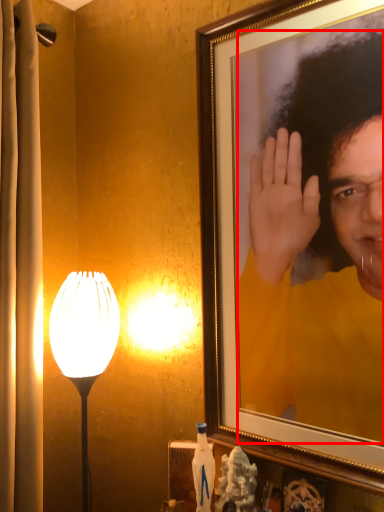
Question: From the image's perspective, what is the correct spatial positioning of person (annotated by the red box) in reference to lamp?

Choices:
 (A) above
 (B) below

Answer: (A)